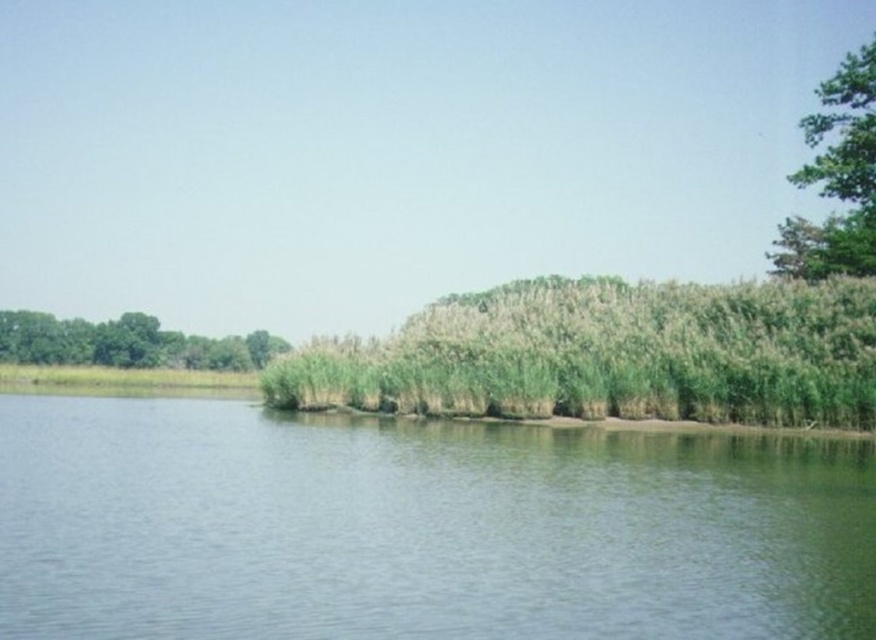
Question: Where is green leafy tree at upper right located in relation to green leafy trees at left in the image?

Choices:
 (A) above
 (B) below

Answer: (A)

Question: Which of the following is the closest to the observer?

Choices:
 (A) green grassy river at center
 (B) green leafy tree at upper right

Answer: (A)

Question: Which of the following is the closest to the observer?

Choices:
 (A) green leafy trees at left
 (B) green grassy river at center

Answer: (B)

Question: Can you confirm if green grassy river at center is wider than green leafy trees at left?

Choices:
 (A) yes
 (B) no

Answer: (B)

Question: Considering the real-world distances, which object is closest to the green leafy tree at upper right?

Choices:
 (A) green leafy trees at left
 (B) green grassy river at center

Answer: (B)

Question: Is green grassy river at center behind green leafy trees at left?

Choices:
 (A) no
 (B) yes

Answer: (A)